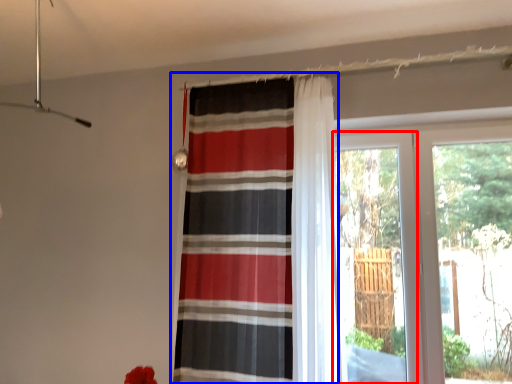
Question: Which point is closer to the camera, screen door (highlighted by a red box) or curtain (highlighted by a blue box)?

Choices:
 (A) screen door
 (B) curtain

Answer: (B)